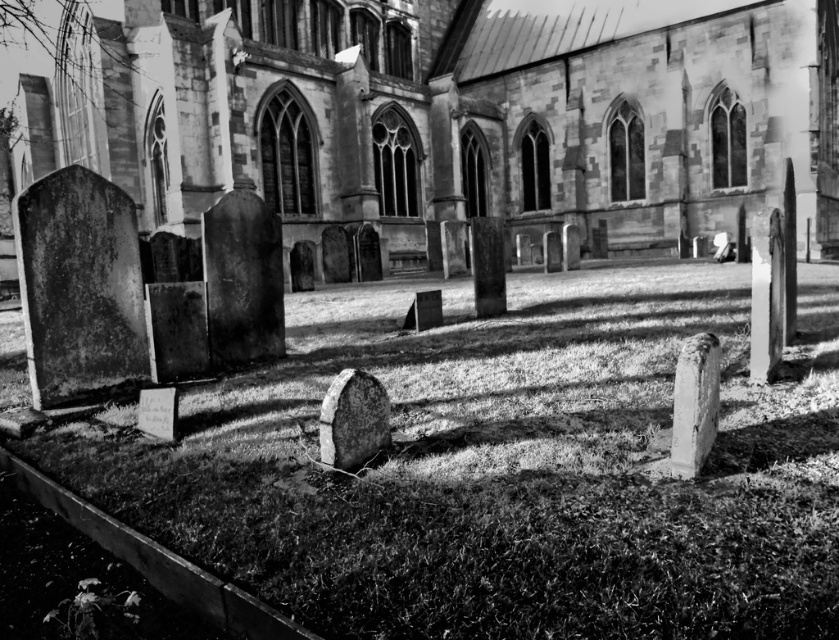
You are standing at the entrance of the historic stone church and see the smooth stone gravestone at lower right and the rough stone gravestone at center. Which gravestone is closer to you?

The smooth stone gravestone at lower right is closer to you because it is in front of the rough stone gravestone at center.

You are a photographer planning to capture the smooth stone church at center and the smooth stone gravestone at lower right in a single frame. Given that your camera has a fixed focal length, which object should you position closer to the camera to ensure both fit within the frame?

To ensure both the smooth stone church at center and the smooth stone gravestone at lower right fit within the frame, position the smooth stone gravestone at lower right closer to the camera. Since the smooth stone church at center is wider, moving the narrower gravestone closer will help balance their apparent sizes in the photograph.